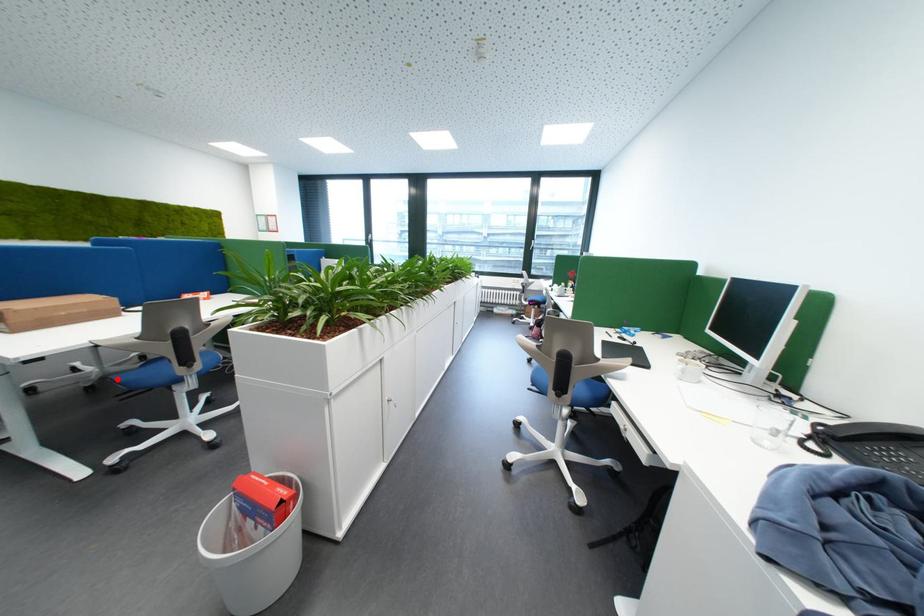
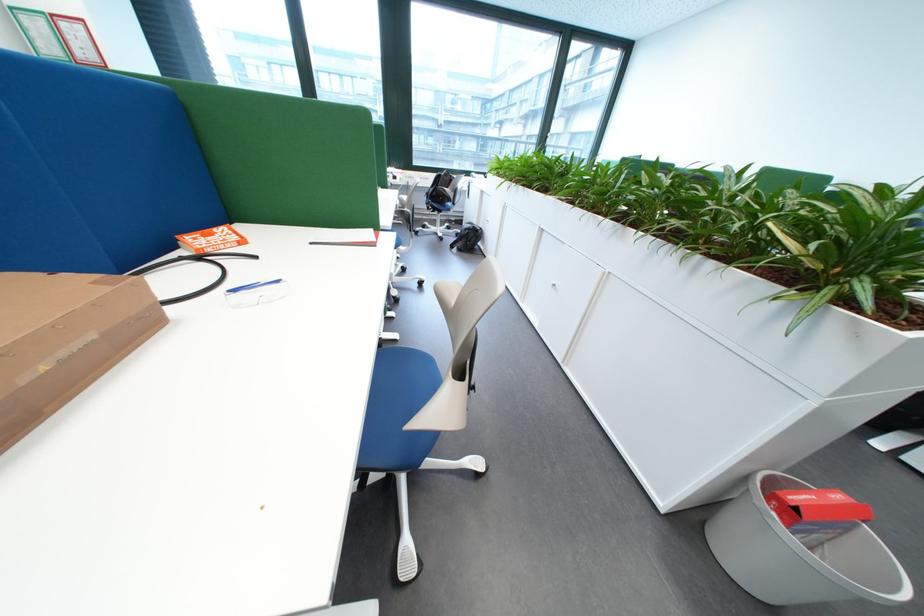
Question: I am providing you with two images of the same scene from different viewpoints. A red point is marked on the first image. Can you still see the location of the red point in image 2?

Choices:
 (A) Yes
 (B) No

Answer: (B)